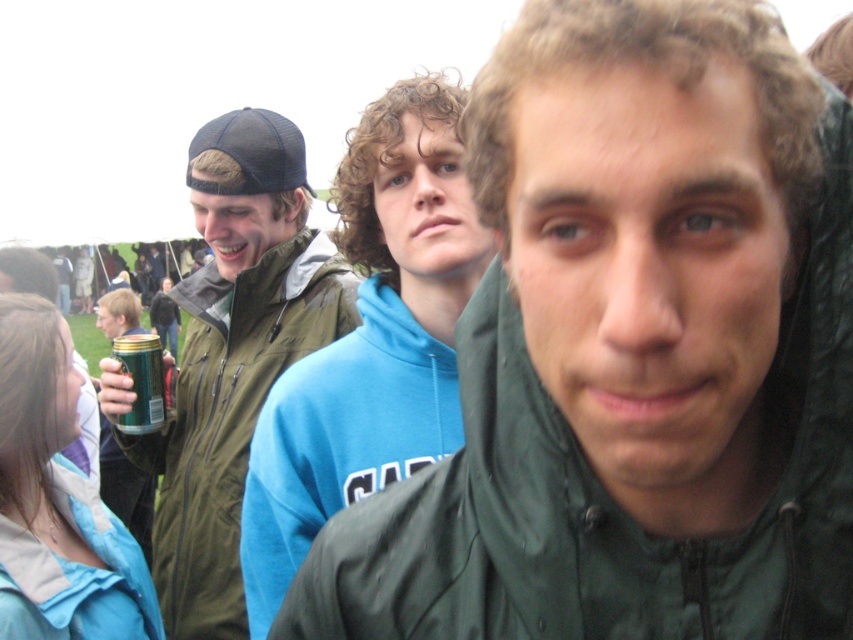
Can you confirm if blue fleece at center is wider than green matte jacket at left?

Incorrect, blue fleece at center's width does not surpass green matte jacket at left's.

Does point (426, 122) come behind point (160, 436)?

No, it is not.

Where is `blue fleece at center`? The height and width of the screenshot is (640, 853). blue fleece at center is located at coordinates (370, 339).

Between green matte jacket at center and blue fleece at center, which one has more height?

Standing taller between the two is blue fleece at center.

Does green matte jacket at center come behind blue fleece at center?

No, green matte jacket at center is closer to the viewer.

Locate an element on the screen. Image resolution: width=853 pixels, height=640 pixels. green matte jacket at center is located at coordinates click(x=631, y=353).

Does blue fleece at center have a smaller size compared to green matte can at center-left?

No.

Is blue fleece at center to the left of green matte can at center-left from the viewer's perspective?

Incorrect, blue fleece at center is not on the left side of green matte can at center-left.

This screenshot has height=640, width=853. I want to click on blue fleece at center, so click(370, 339).